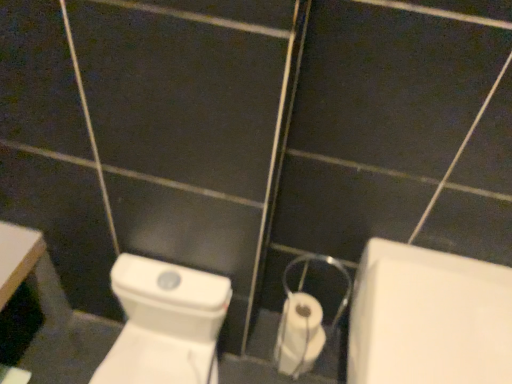
Question: From the image's perspective, would you say white glossy toilet at center is positioned over white plastic toilet paper at center?

Choices:
 (A) yes
 (B) no

Answer: (B)

Question: Would you consider white glossy toilet at center to be distant from white plastic toilet paper at center?

Choices:
 (A) no
 (B) yes

Answer: (A)

Question: Does white glossy toilet at center appear on the left side of white plastic toilet paper at center?

Choices:
 (A) no
 (B) yes

Answer: (B)

Question: Is white glossy toilet at center behind white plastic toilet paper at center?

Choices:
 (A) no
 (B) yes

Answer: (A)

Question: Is white glossy toilet at center wider than white plastic toilet paper at center?

Choices:
 (A) yes
 (B) no

Answer: (A)

Question: In the image, is white glossy toilet at center on the left side or the right side of white glossy bath at lower right?

Choices:
 (A) left
 (B) right

Answer: (A)

Question: From a real-world perspective, is white glossy toilet at center above or below white glossy bath at lower right?

Choices:
 (A) above
 (B) below

Answer: (B)

Question: Considering the positions of white glossy toilet at center and white glossy bath at lower right in the image, is white glossy toilet at center taller or shorter than white glossy bath at lower right?

Choices:
 (A) tall
 (B) short

Answer: (B)

Question: Is point (137, 332) positioned closer to the camera than point (479, 269)?

Choices:
 (A) farther
 (B) closer

Answer: (A)

Question: Is white glossy toilet at center inside or outside of white plastic toilet paper at center?

Choices:
 (A) outside
 (B) inside

Answer: (A)

Question: Considering the relative positions of white glossy toilet at center and white plastic toilet paper at center in the image provided, is white glossy toilet at center to the left or to the right of white plastic toilet paper at center?

Choices:
 (A) right
 (B) left

Answer: (B)

Question: From their relative heights in the image, would you say white glossy toilet at center is taller or shorter than white plastic toilet paper at center?

Choices:
 (A) short
 (B) tall

Answer: (B)

Question: Is point (154, 362) positioned closer to the camera than point (348, 294)?

Choices:
 (A) closer
 (B) farther

Answer: (A)

Question: In terms of width, does white plastic toilet paper at center look wider or thinner when compared to white glossy bath at lower right?

Choices:
 (A) thin
 (B) wide

Answer: (A)

Question: Considering their positions, is white plastic toilet paper at center located in front of or behind white glossy bath at lower right?

Choices:
 (A) behind
 (B) front

Answer: (A)